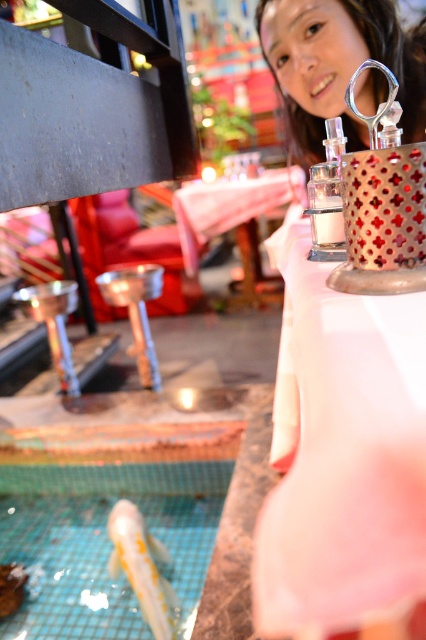
Question: Does white glossy fish at bottom left appear on the left side of clear glass perfume at center?

Choices:
 (A) yes
 (B) no

Answer: (A)

Question: Which object is farther from the camera taking this photo?

Choices:
 (A) yellow glossy chopsticks at lower left
 (B) smooth white fish at lower left

Answer: (B)

Question: Does smooth skin girl at upper center appear over clear glass perfume at center?

Choices:
 (A) yes
 (B) no

Answer: (A)

Question: Estimate the real-world distances between objects in this image. Which object is farther from the metallic polished stool at center?

Choices:
 (A) yellow glossy chopsticks at lower left
 (B) smooth skin girl at upper center

Answer: (B)

Question: Which point is closer to the camera?

Choices:
 (A) (8, 572)
 (B) (333, 109)

Answer: (B)

Question: Does white glossy fish at bottom left appear under clear glass perfume at center?

Choices:
 (A) no
 (B) yes

Answer: (B)